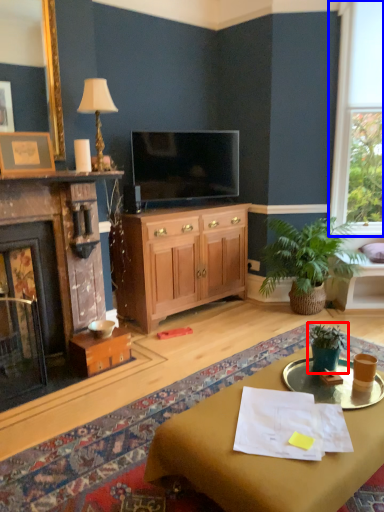
Question: Which of the following is the farthest to the observer, houseplant (highlighted by a red box) or window (highlighted by a blue box)?

Choices:
 (A) houseplant
 (B) window

Answer: (B)